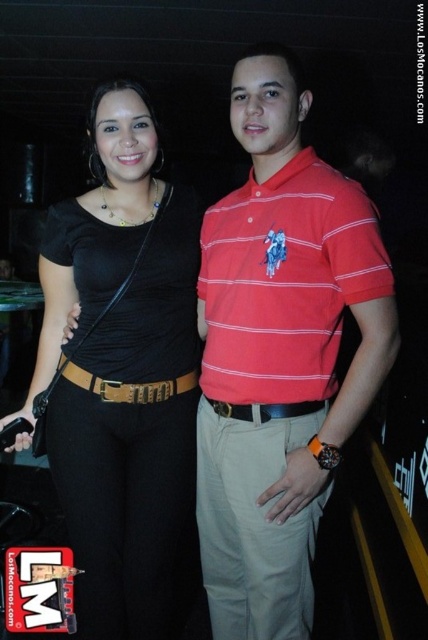
Looking at this image, you are at a party and want to take a closer look at the red striped polo shirt at center and the black leather belt at center. Which one is positioned higher on the person?

The red striped polo shirt at center is located above the black leather belt at center, so it is positioned higher on the person.